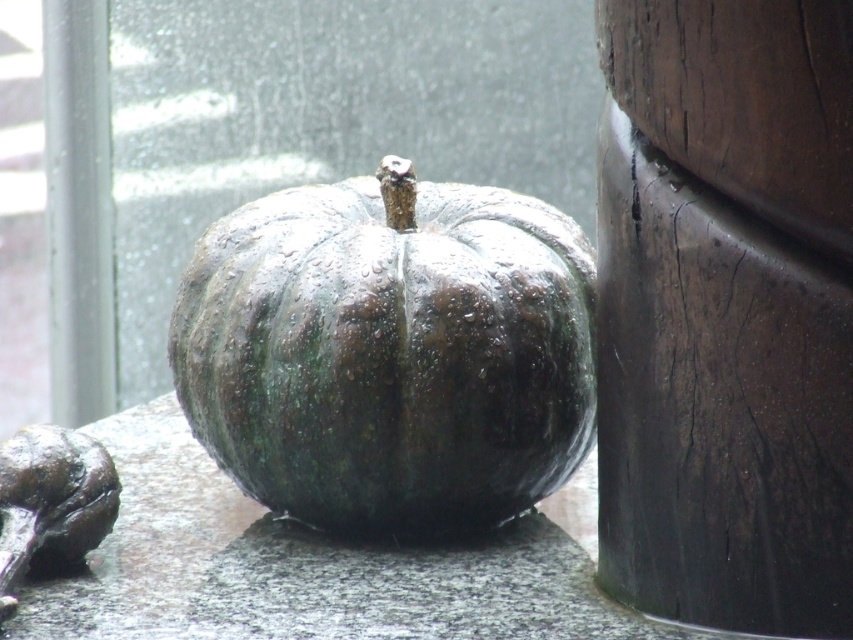
Question: Can you confirm if dark brown wood at right is wider than wet dark green pumpkin at center?

Choices:
 (A) no
 (B) yes

Answer: (A)

Question: Among these objects, which one is farthest from the camera?

Choices:
 (A) dark brown wood at right
 (B) wet dark green pumpkin at center

Answer: (B)

Question: Does dark brown wood at right appear on the left side of wet dark green pumpkin at center?

Choices:
 (A) no
 (B) yes

Answer: (A)

Question: Is dark brown wood at right above wet dark green pumpkin at center?

Choices:
 (A) yes
 (B) no

Answer: (A)

Question: Among these points, which one is farthest from the camera?

Choices:
 (A) (664, 145)
 (B) (491, 273)

Answer: (B)

Question: Which point is farther from the camera taking this photo?

Choices:
 (A) (839, 42)
 (B) (519, 428)

Answer: (B)